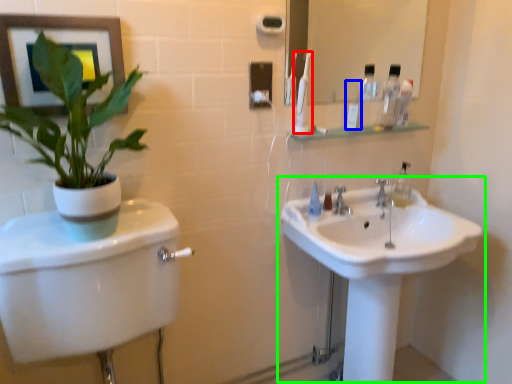
Question: Which object is positioned farthest from toothbrush (highlighted by a red box)? Select from toiletry (highlighted by a blue box) and sink (highlighted by a green box).

Choices:
 (A) toiletry
 (B) sink

Answer: (B)